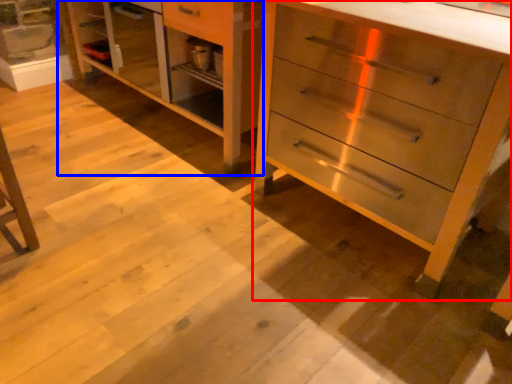
Question: Which object is further to the camera taking this photo, chest of drawers (highlighted by a red box) or dresser (highlighted by a blue box)?

Choices:
 (A) chest of drawers
 (B) dresser

Answer: (B)